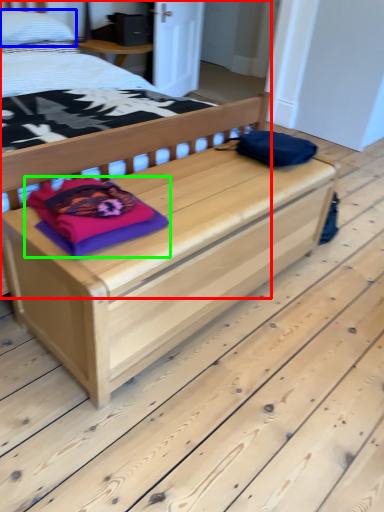
Question: Which object is positioned closest to bed (highlighted by a red box)? Select from pillow (highlighted by a blue box) and material (highlighted by a green box).

Choices:
 (A) pillow
 (B) material

Answer: (A)